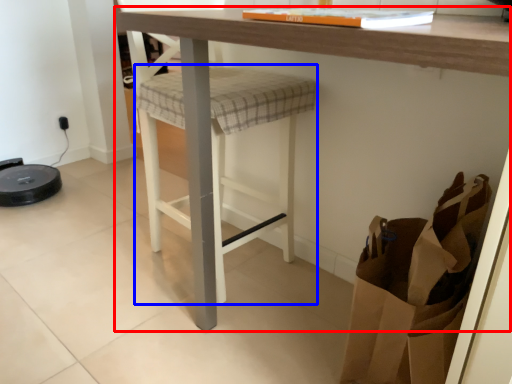
Question: Which object is closer to the camera taking this photo, table (highlighted by a red box) or step stool (highlighted by a blue box)?

Choices:
 (A) table
 (B) step stool

Answer: (A)